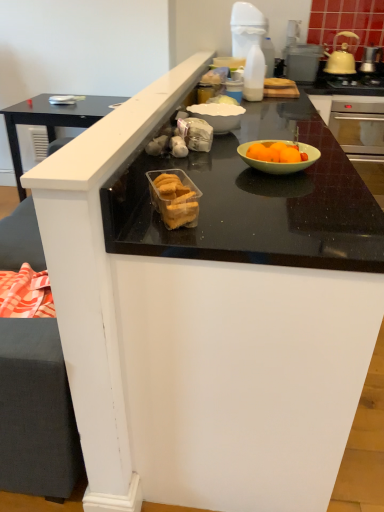
Question: From the image's perspective, is translucent plastic container of cookies at center located beneath black glass gas stove at upper right?

Choices:
 (A) no
 (B) yes

Answer: (B)

Question: Is translucent plastic container of cookies at center looking in the opposite direction of black glass gas stove at upper right?

Choices:
 (A) yes
 (B) no

Answer: (B)

Question: From a real-world perspective, is translucent plastic container of cookies at center below black glass gas stove at upper right?

Choices:
 (A) yes
 (B) no

Answer: (B)

Question: From a real-world perspective, is translucent plastic container of cookies at center physically above black glass gas stove at upper right?

Choices:
 (A) yes
 (B) no

Answer: (A)

Question: Does translucent plastic container of cookies at center lie in front of black glass gas stove at upper right?

Choices:
 (A) no
 (B) yes

Answer: (B)

Question: Can you confirm if translucent plastic container of cookies at center is taller than black glass gas stove at upper right?

Choices:
 (A) yes
 (B) no

Answer: (A)

Question: Does yellow ceramic kettle at upper right come in front of metallic silver toaster at upper right?

Choices:
 (A) no
 (B) yes

Answer: (B)

Question: Can you confirm if yellow ceramic kettle at upper right is taller than metallic silver toaster at upper right?

Choices:
 (A) no
 (B) yes

Answer: (B)

Question: Is yellow ceramic kettle at upper right outside of metallic silver toaster at upper right?

Choices:
 (A) yes
 (B) no

Answer: (A)

Question: Can you confirm if yellow ceramic kettle at upper right is shorter than metallic silver toaster at upper right?

Choices:
 (A) no
 (B) yes

Answer: (A)

Question: Does yellow ceramic kettle at upper right lie behind metallic silver toaster at upper right?

Choices:
 (A) no
 (B) yes

Answer: (A)

Question: Is yellow ceramic kettle at upper right far away from metallic silver toaster at upper right?

Choices:
 (A) yes
 (B) no

Answer: (B)

Question: Considering the relative sizes of translucent plastic container of cookies at center and yellow ceramic kettle at upper right in the image provided, is translucent plastic container of cookies at center wider than yellow ceramic kettle at upper right?

Choices:
 (A) no
 (B) yes

Answer: (A)